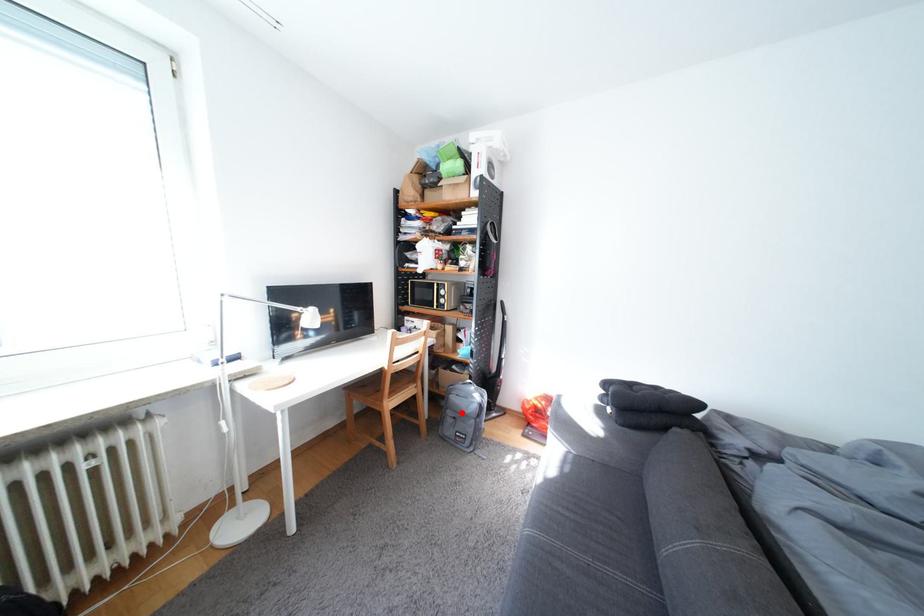
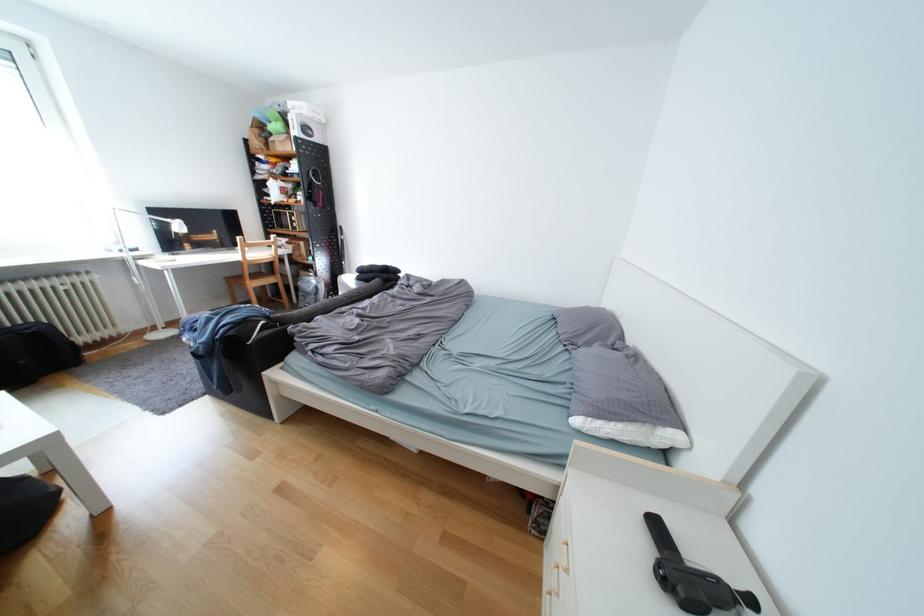
Question: I am providing you with two images of the same scene from different viewpoints. A red point is shown in image1. For the corresponding object point in image2, is it positioned nearer or farther from the camera?

Choices:
 (A) Nearer
 (B) Farther

Answer: (B)